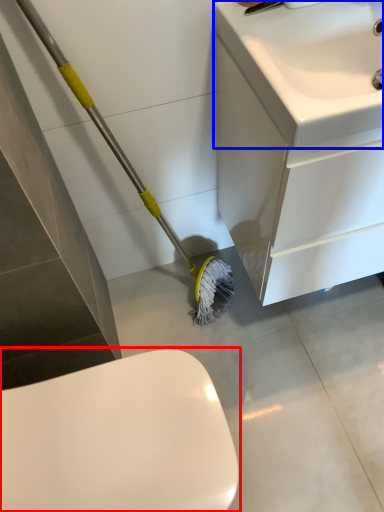
Question: Which point is closer to the camera, toilet (highlighted by a red box) or sink (highlighted by a blue box)?

Choices:
 (A) toilet
 (B) sink

Answer: (B)